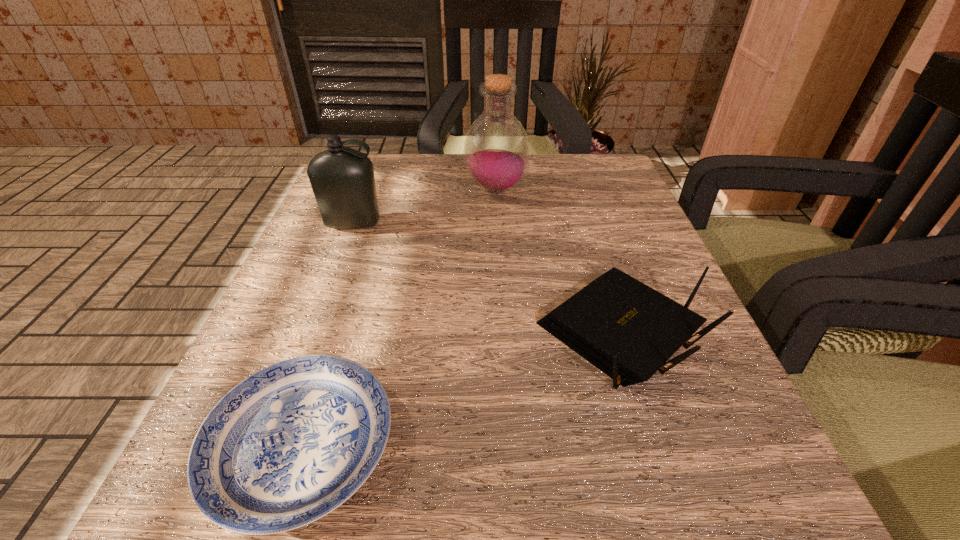
Find the location of a particular element. This screenshot has height=540, width=960. the taller bottle is located at coordinates (496, 150).

Find the location of a particular element. the farther bottle is located at coordinates (496, 150).

Where is `the shorter bottle`? The width and height of the screenshot is (960, 540). the shorter bottle is located at coordinates (342, 179).

Identify the location of the second farthest object. (342, 179).

Locate an element on the screen. The width and height of the screenshot is (960, 540). the third tallest object is located at coordinates (626, 329).

Identify the location of blank area located on the left of the tallest object. Image resolution: width=960 pixels, height=540 pixels. (371, 190).

At what (x,y) coordinates should I click in order to perform the action: click on blank area located on the front of the left bottle. Please return your answer as a coordinate pair (x, y). This screenshot has width=960, height=540. Looking at the image, I should click on (330, 282).

Locate an element on the screen. This screenshot has width=960, height=540. vacant space located 0.120m on the back of the third tallest object is located at coordinates (588, 235).

What are the coordinates of `object at the far edge` in the screenshot? It's located at (496, 150).

Where is `object located at the left edge`? The width and height of the screenshot is (960, 540). object located at the left edge is located at coordinates (342, 179).